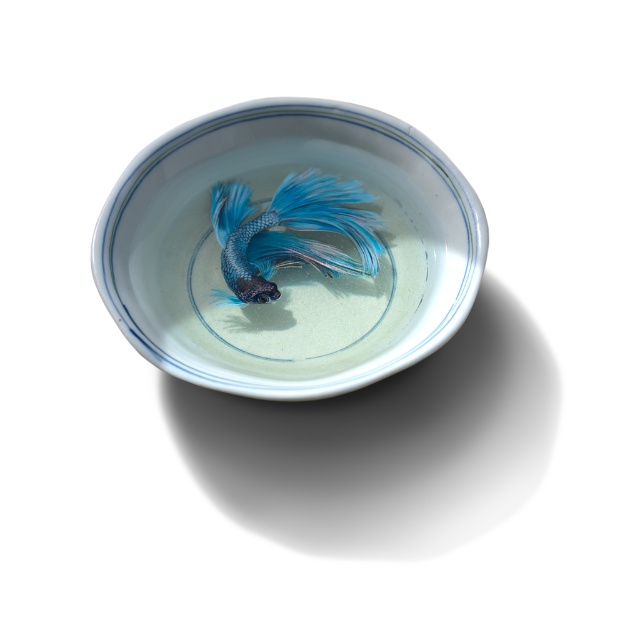
Question: Which object is farther from the camera taking this photo?

Choices:
 (A) blue glossy fish at center
 (B) porcelain bowl at center

Answer: (A)

Question: Is the position of porcelain bowl at center less distant than that of blue glossy fish at center?

Choices:
 (A) no
 (B) yes

Answer: (B)

Question: Is porcelain bowl at center below blue glossy fish at center?

Choices:
 (A) no
 (B) yes

Answer: (B)

Question: From the image, what is the correct spatial relationship of porcelain bowl at center in relation to blue glossy fish at center?

Choices:
 (A) left
 (B) right

Answer: (A)

Question: Which of the following is the farthest from the observer?

Choices:
 (A) (200, 218)
 (B) (224, 260)

Answer: (A)